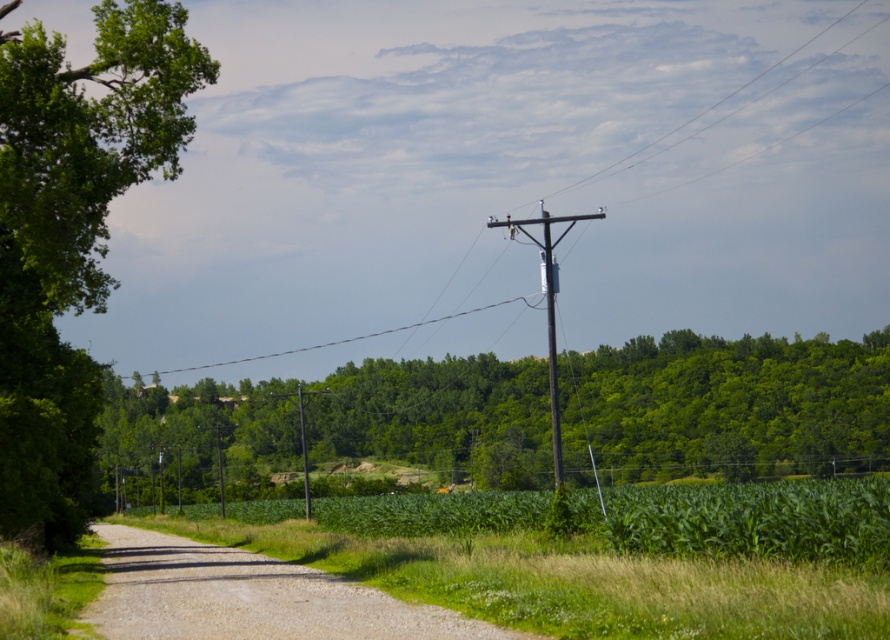
The image size is (890, 640). Describe the element at coordinates (508, 180) in the screenshot. I see `brown wooden pole at upper center` at that location.

Measure the distance between brown wooden pole at upper center and green leafy tree at center.

brown wooden pole at upper center and green leafy tree at center are 122.89 feet apart from each other.

Who is more distant from viewer, [260,84] or [247,483]?

Positioned behind is point [260,84].

What are the coordinates of `brown wooden pole at upper center` in the screenshot? It's located at (508, 180).

Is green leafy tree at left below brown wooden pole at center?

No.

Can you confirm if green leafy tree at left is thinner than brown wooden pole at center?

No.

Is point (31, 173) positioned after point (301, 406)?

No.

Identify the location of green leafy tree at left. The height and width of the screenshot is (640, 890). (71, 232).

Between point (77, 481) and point (559, 445), which one is positioned behind?

Point (77, 481)

Identify the location of green leafy tree at left. (71, 232).